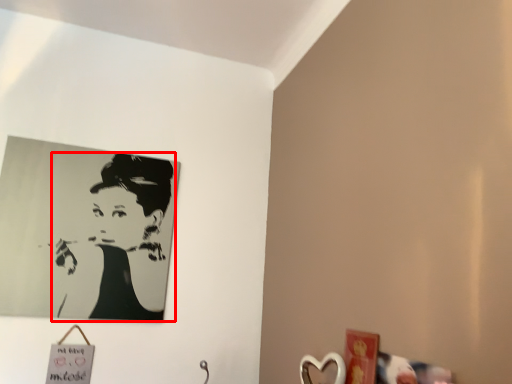
Question: Observing the image, what is the correct spatial positioning of woman (annotated by the red box) in reference to picture frame?

Choices:
 (A) right
 (B) left

Answer: (B)